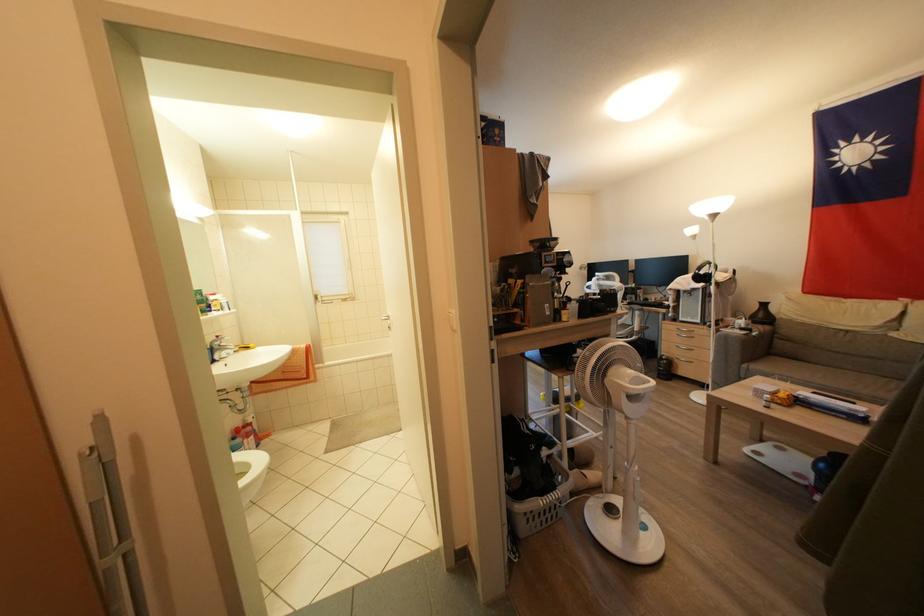
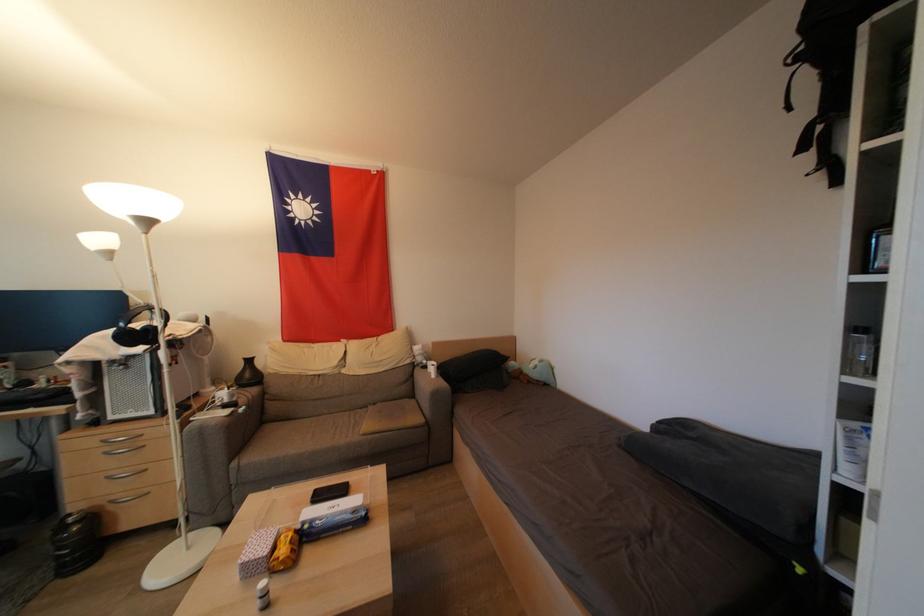
The point at (x=675, y=366) is marked in the first image. Where is the corresponding point in the second image?

(99, 521)